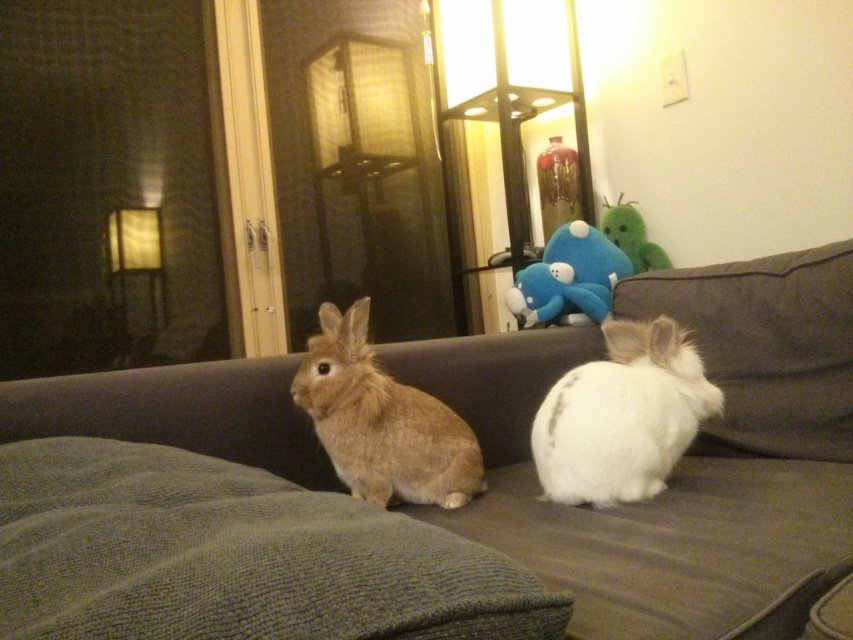
You are standing in the room and want to sit on the brown fabric couch at center. Based on its position, where should you walk to reach it?

The brown fabric couch at center is located at point [683,458], so you should walk towards the coordinates [683,458] to reach it.

You are standing at the entrance of the room and want to sit on the brown fabric couch at center. According to the coordinates provided, in which direction should you move to reach it?

The brown fabric couch at center is located at coordinates point (683, 458), which means it is positioned towards the lower right side of the room. Therefore, you should move towards the lower right direction to reach it.

You are a small child trying to reach the green plush toy at upper center from the brown fabric couch at center. Can you easily reach it?

The brown fabric couch at center is much taller than the green plush toy at upper center, so the green plush toy at upper center is lower in height. Therefore, you can easily reach the green plush toy at upper center from the brown fabric couch at center.